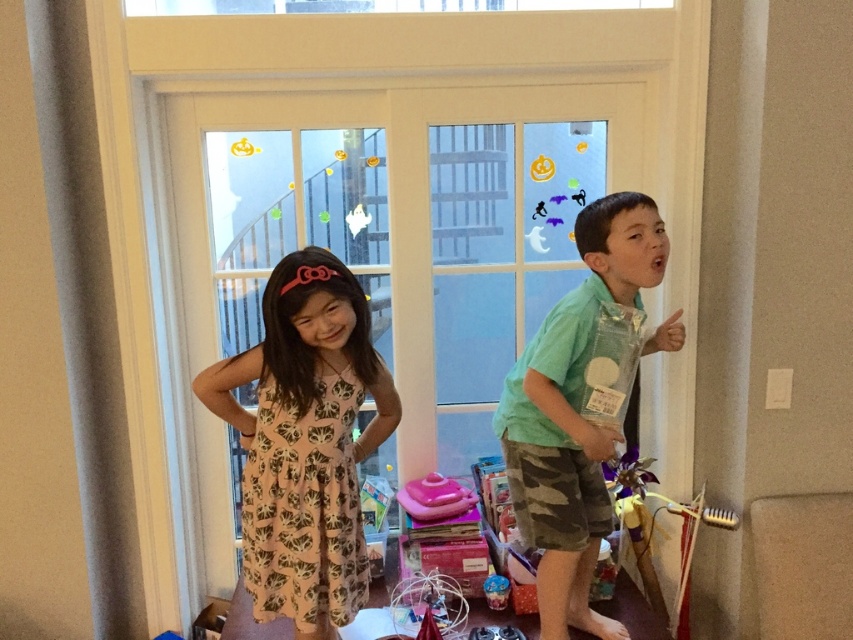
Question: Which object is closer to the camera taking this photo?

Choices:
 (A) pink plastic toy at center
 (B) pink fabric dress at center

Answer: (B)

Question: Does green cotton shirt at right appear over pink plastic toy at center?

Choices:
 (A) yes
 (B) no

Answer: (A)

Question: Among these points, which one is nearest to the camera?

Choices:
 (A) (434, 509)
 (B) (589, 518)

Answer: (B)

Question: Does pink fabric dress at center appear on the left side of green cotton shirt at right?

Choices:
 (A) yes
 (B) no

Answer: (A)

Question: Considering the real-world distances, which object is closest to the pink plastic toy at center?

Choices:
 (A) pink fabric dress at center
 (B) green cotton shirt at right

Answer: (B)

Question: In this image, where is green cotton shirt at right located relative to pink plastic toy at center?

Choices:
 (A) left
 (B) right

Answer: (B)